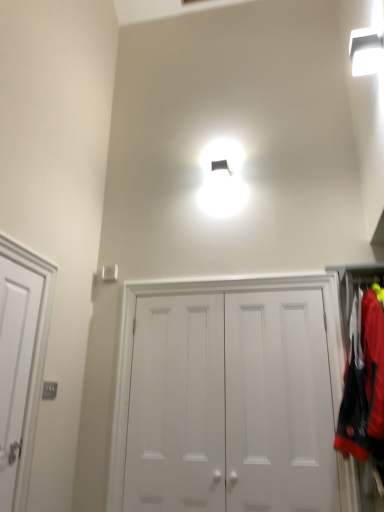
Question: Considering the positions of red fabric laundry at right and white matte door at center, placed as the first door when sorted from right to left, in the image, is red fabric laundry at right taller or shorter than white matte door at center, placed as the first door when sorted from right to left,?

Choices:
 (A) tall
 (B) short

Answer: (B)

Question: Is point (360, 429) closer or farther from the camera than point (139, 354)?

Choices:
 (A) closer
 (B) farther

Answer: (A)

Question: Based on their relative distances, which object is farther from the red fabric laundry at right?

Choices:
 (A) white matte door at center, the 2th door from the left
 (B) white matte door at center, placed as the first door when sorted from right to left
 (C) white matte door at left, which is the first door from left to right

Answer: (C)

Question: Estimate the real-world distances between objects in this image. Which object is farther from the white matte door at center, which ranks as the 3th door in left-to-right order?

Choices:
 (A) white matte door at center, the 2th door from the left
 (B) white matte door at left, which is the first door from left to right
 (C) red fabric laundry at right

Answer: (B)